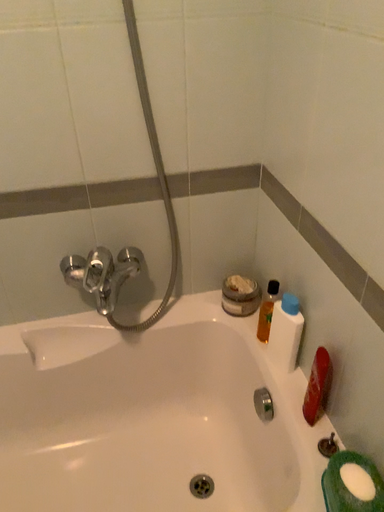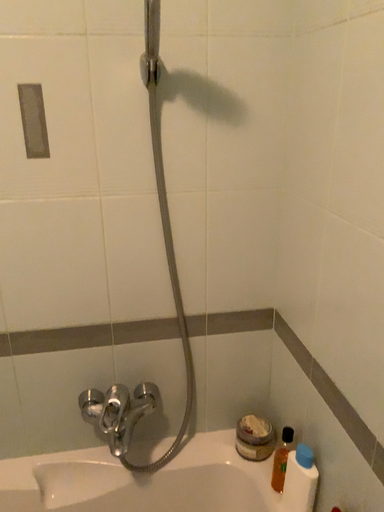
Question: How did the camera likely rotate when shooting the video?

Choices:
 (A) rotated upward
 (B) rotated downward

Answer: (A)